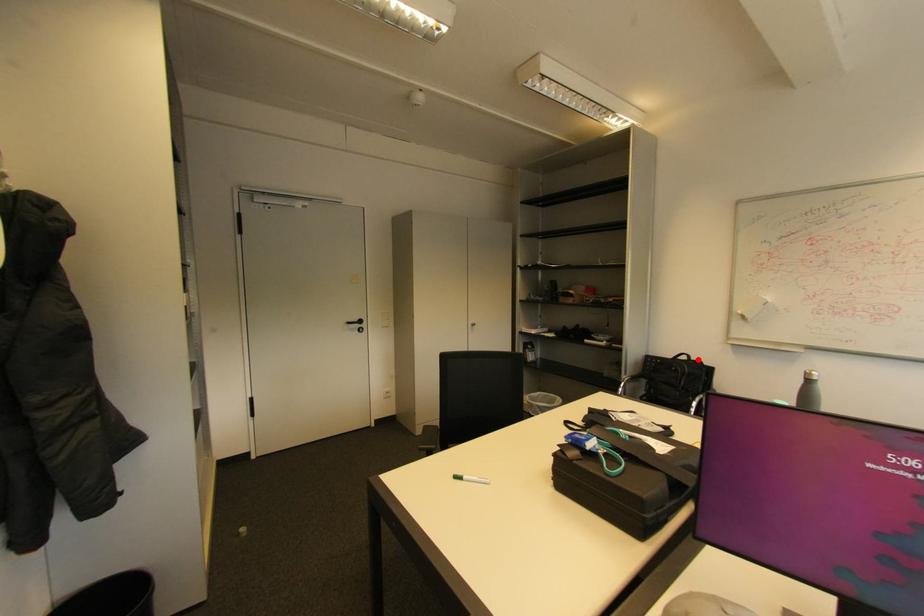
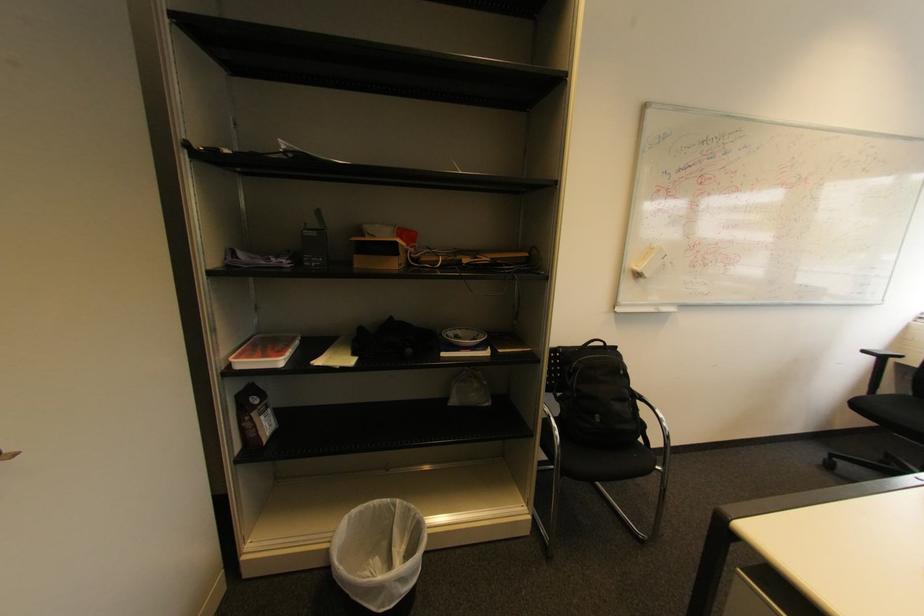
In the second image, find the point that corresponds to the highlighted location in the first image.

(613, 345)